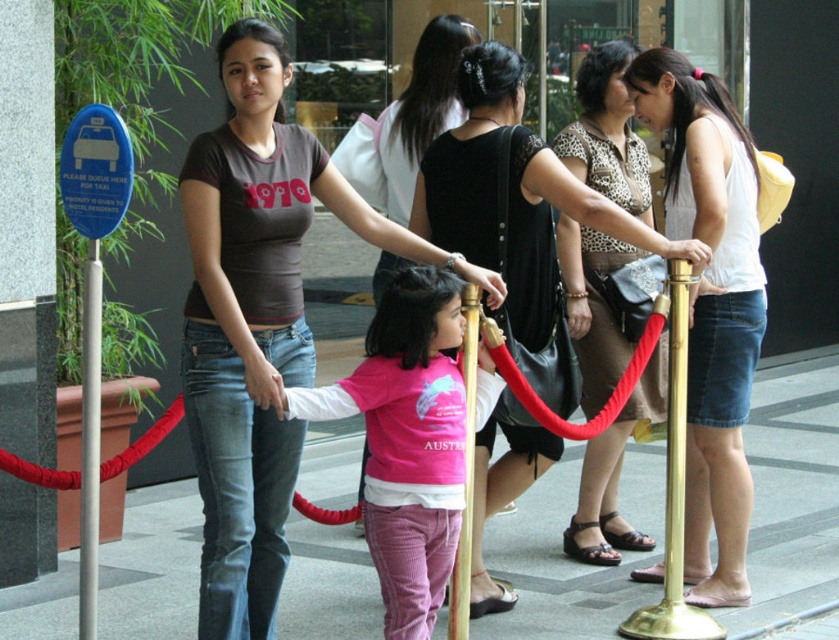
Question: Which point appears farthest from the camera in this image?

Choices:
 (A) (706, 250)
 (B) (477, 328)
 (C) (441, 156)
 (D) (373, 337)

Answer: (C)

Question: Which point is closer to the camera?

Choices:
 (A) (426, 170)
 (B) (632, 166)
 (C) (477, 275)
 (D) (253, 276)

Answer: (D)

Question: Can you confirm if pink velvety shirt at center is positioned above gold metallic pole at center?

Choices:
 (A) yes
 (B) no

Answer: (A)

Question: Which point is closer to the camera?

Choices:
 (A) (400, 324)
 (B) (253, 390)

Answer: (B)

Question: Does white denim skirt at center appear over leopard print blouse at center?

Choices:
 (A) yes
 (B) no

Answer: (B)

Question: Does pink velvety shirt at center appear on the right side of matte black handbag at center?

Choices:
 (A) no
 (B) yes

Answer: (A)